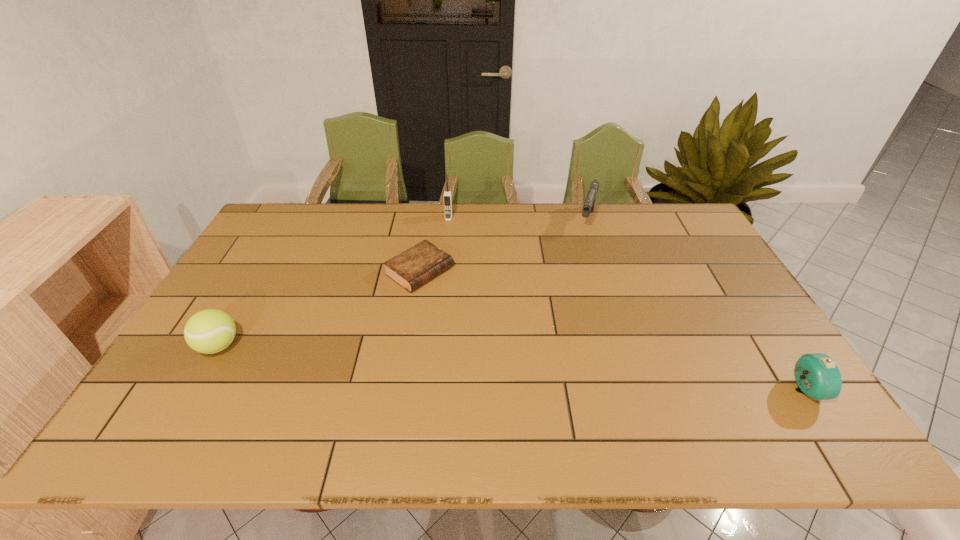
This screenshot has height=540, width=960. Identify the location of free region located in the direction the second object from right to left is aimed. (566, 298).

Where is `vacant area situated 0.340m in the direction the second object from right to left is aimed`? Image resolution: width=960 pixels, height=540 pixels. vacant area situated 0.340m in the direction the second object from right to left is aimed is located at coordinates (566, 298).

Locate an element on the screen. The height and width of the screenshot is (540, 960). free space located on the spine side of the diary is located at coordinates (503, 329).

Locate an element on the screen. free space located 0.070m on the spine side of the diary is located at coordinates (459, 299).

Find the location of `vacant space located on the spine side of the diary`. vacant space located on the spine side of the diary is located at coordinates (497, 325).

Identify the location of vacant space located 0.360m on the front-facing side of the cellular telephone. This screenshot has height=540, width=960. (438, 289).

Identify the location of free space located on the front-facing side of the cellular telephone. The image size is (960, 540). (442, 264).

Locate an element on the screen. The image size is (960, 540). free location located on the front-facing side of the cellular telephone is located at coordinates (444, 246).

Find the location of `gun present at the far edge`. gun present at the far edge is located at coordinates (588, 206).

Locate an element on the screen. The width and height of the screenshot is (960, 540). cellular telephone present at the far edge is located at coordinates (447, 196).